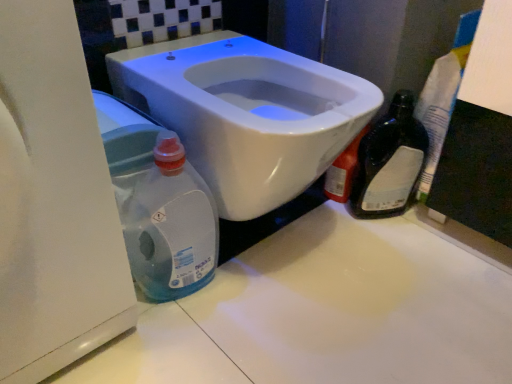
This screenshot has width=512, height=384. Find the location of `vacant region to the right of black glass bottle at right`. vacant region to the right of black glass bottle at right is located at coordinates (446, 230).